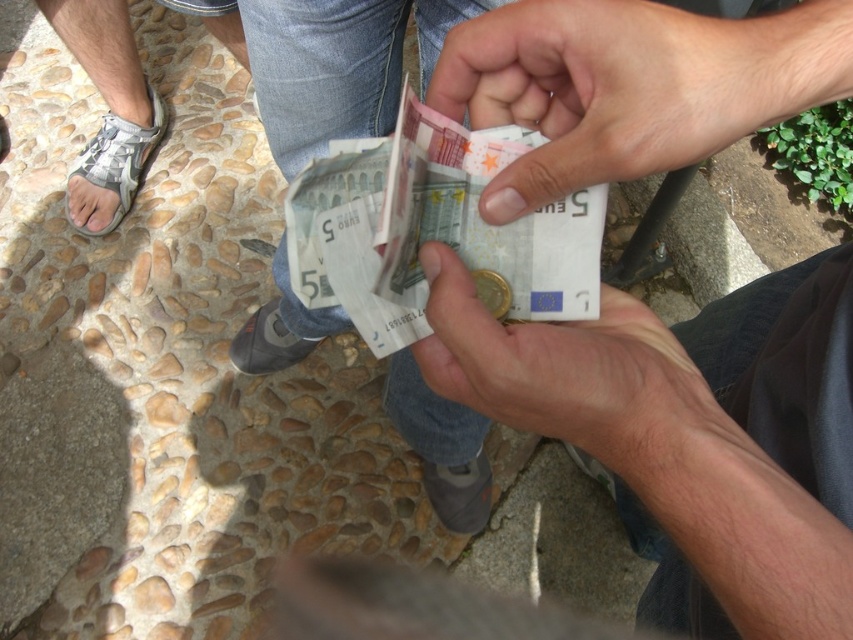
Can you confirm if matte paper money at center is shorter than white woven sandal at left?

Indeed, matte paper money at center has a lesser height compared to white woven sandal at left.

Who is lower down, matte paper money at center or white woven sandal at left?

matte paper money at center is lower down.

Is point (462, 324) farther from camera compared to point (111, 125)?

No.

The width and height of the screenshot is (853, 640). What are the coordinates of `matte paper money at center` in the screenshot? It's located at (563, 369).

Describe the element at coordinates (434, 228) in the screenshot. The width and height of the screenshot is (853, 640). I see `white paper banknotes at center` at that location.

From the picture: Between white paper banknotes at center and white woven sandal at left, which one appears on the right side from the viewer's perspective?

white paper banknotes at center

You are a GUI agent. You are given a task and a screenshot of the screen. Output one action in this format:
    pyautogui.click(x=<x>, y=<y>)
    Task: Click on the white paper banknotes at center
    
    Given the screenshot: What is the action you would take?
    pyautogui.click(x=434, y=228)

Is matte skin hand at center smaller than matte paper money at center?

Yes.

Can you confirm if matte skin hand at center is taller than matte paper money at center?

Incorrect, matte skin hand at center's height is not larger of matte paper money at center's.

Who is more forward, (618, 49) or (656, 449)?

Positioned in front is point (656, 449).

Where is `matte skin hand at center`? The height and width of the screenshot is (640, 853). matte skin hand at center is located at coordinates (602, 90).